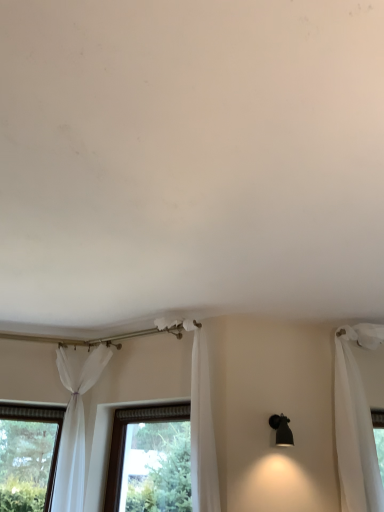
Question: From a real-world perspective, is white sheer curtain at center, which is counted as the 2th curtain, starting from the left, above or below clear glass window at center?

Choices:
 (A) below
 (B) above

Answer: (B)

Question: Is point (210, 463) positioned closer to the camera than point (112, 430)?

Choices:
 (A) closer
 (B) farther

Answer: (A)

Question: Based on their relative distances, which object is farther from the sheer white curtain at lower left, arranged as the 2th curtain when viewed from the right?

Choices:
 (A) black matte wall sconce at right
 (B) clear glass window at center
 (C) white sheer curtain at center, positioned as the 1th curtain in right-to-left order

Answer: (A)

Question: Which is farther from the white sheer curtain at center, positioned as the 1th curtain in right-to-left order?

Choices:
 (A) black matte wall sconce at right
 (B) clear glass window at center
 (C) sheer white curtain at lower left, which appears as the first curtain when viewed from the left

Answer: (C)